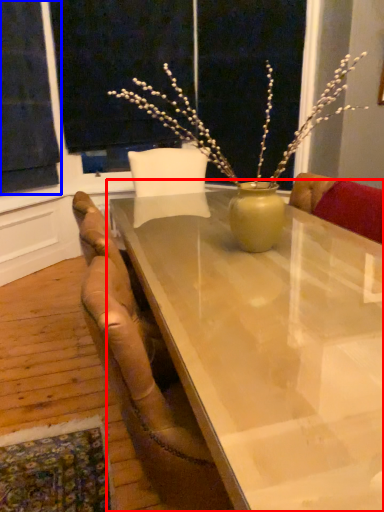
Question: Which object appears closest to the camera in this image, table (highlighted by a red box) or curtain (highlighted by a blue box)?

Choices:
 (A) table
 (B) curtain

Answer: (A)